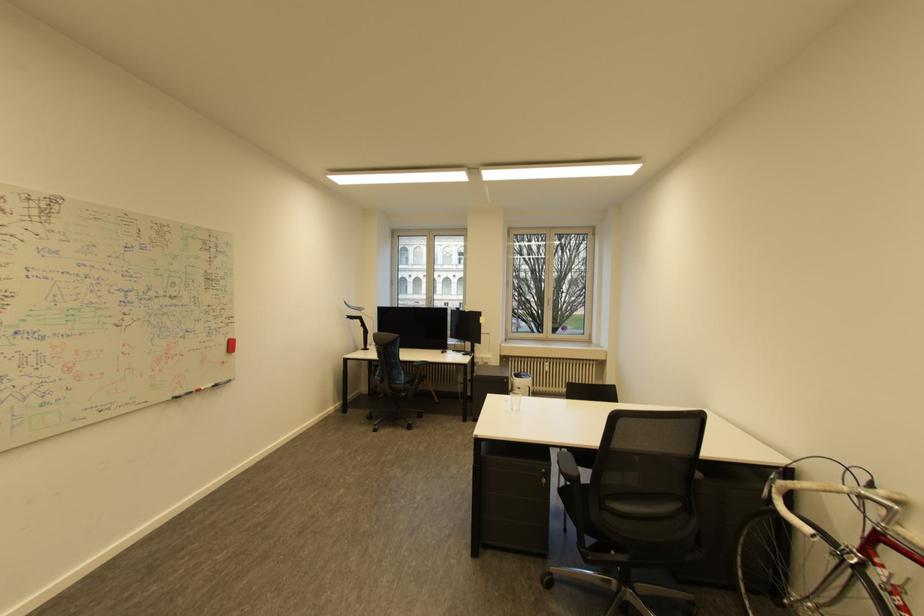
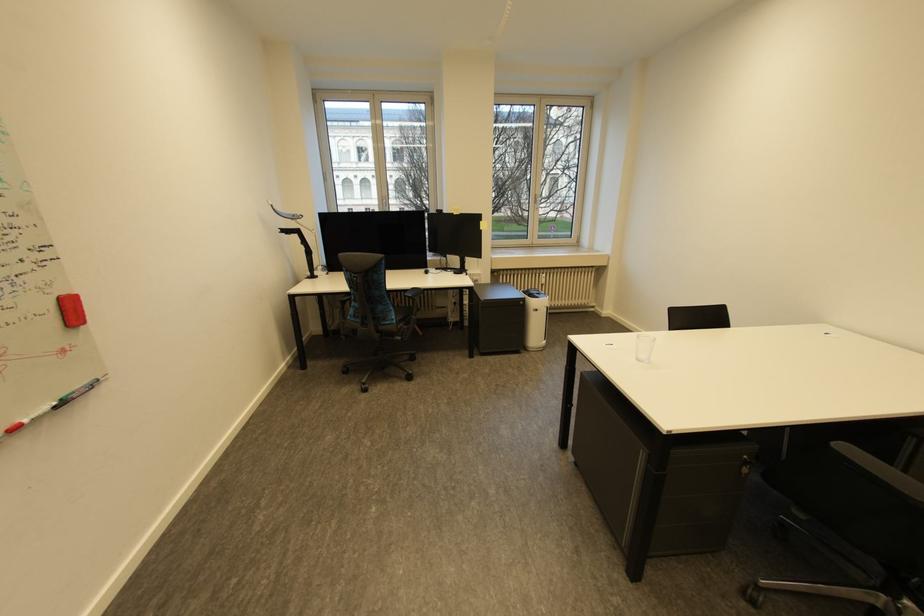
The point at (431, 306) is marked in the first image. Where is the corresponding point in the second image?

(383, 209)